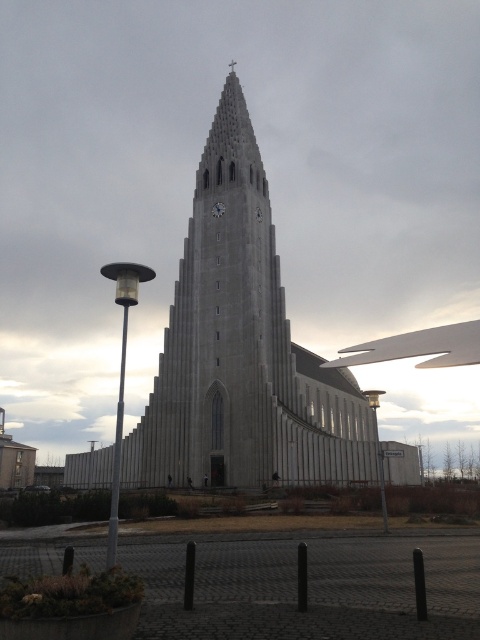
Question: Can you confirm if gray stone church at center is smaller than metallic clock at center?

Choices:
 (A) no
 (B) yes

Answer: (A)

Question: Which point is closer to the camera?

Choices:
 (A) (224, 204)
 (B) (194, 378)

Answer: (B)

Question: Among these points, which one is nearest to the camera?

Choices:
 (A) (244, 365)
 (B) (217, 212)

Answer: (A)

Question: Is gray stone church at center closer to the viewer compared to metallic clock at center?

Choices:
 (A) no
 (B) yes

Answer: (B)

Question: Can you confirm if gray stone church at center is bigger than metallic clock at center?

Choices:
 (A) yes
 (B) no

Answer: (A)